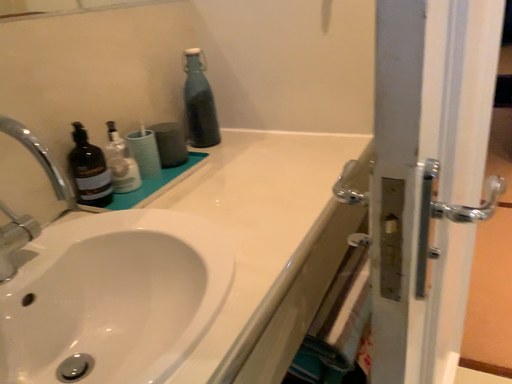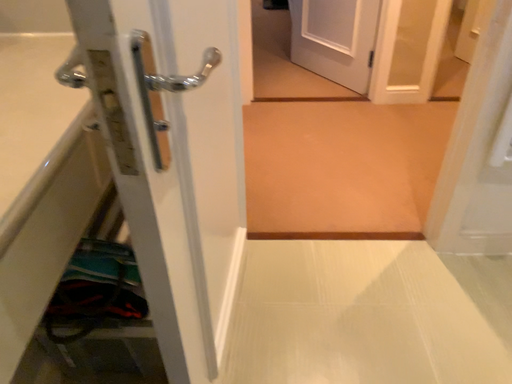
Question: How did the camera likely rotate when shooting the video?

Choices:
 (A) rotated upward
 (B) rotated downward

Answer: (B)